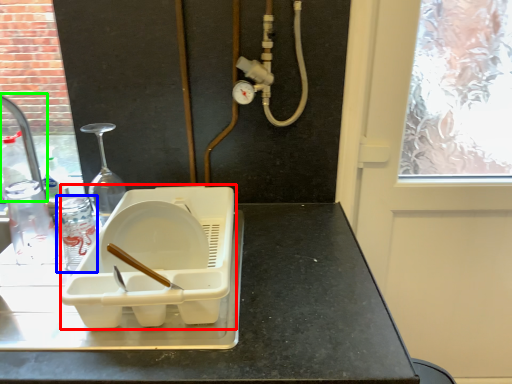
Question: Which object is the closest to the appliance (highlighted by a red box)? Choose among these: bottle (highlighted by a blue box) or faucet (highlighted by a green box).

Choices:
 (A) bottle
 (B) faucet

Answer: (A)